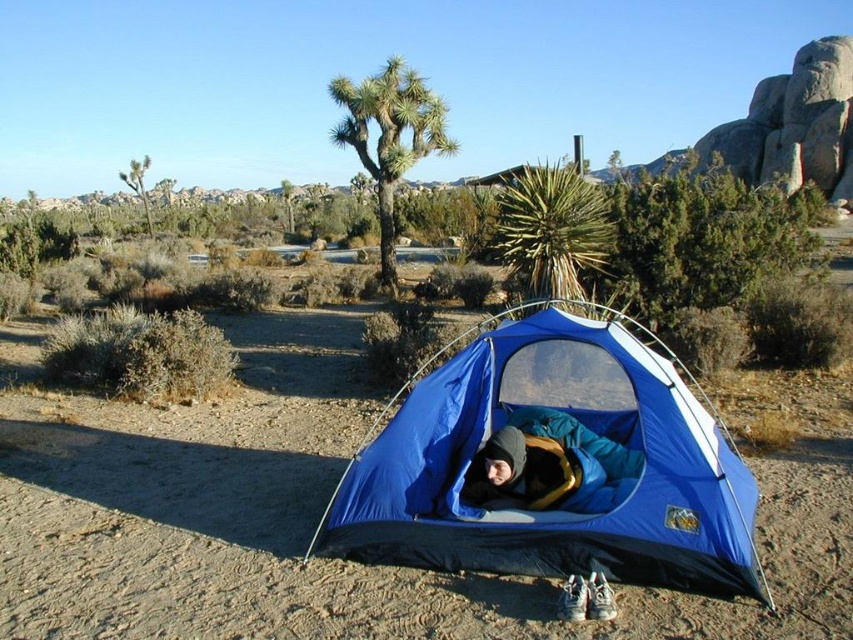
The height and width of the screenshot is (640, 853). Identify the location of blue fabric tent at center. (553, 465).

Between blue fabric tent at center and blue fabric sleeping bag at center, which one is positioned lower?

blue fabric sleeping bag at center is below.

Identify the location of blue fabric tent at center. The image size is (853, 640). (553, 465).

This screenshot has height=640, width=853. I want to click on blue fabric tent at center, so click(x=553, y=465).